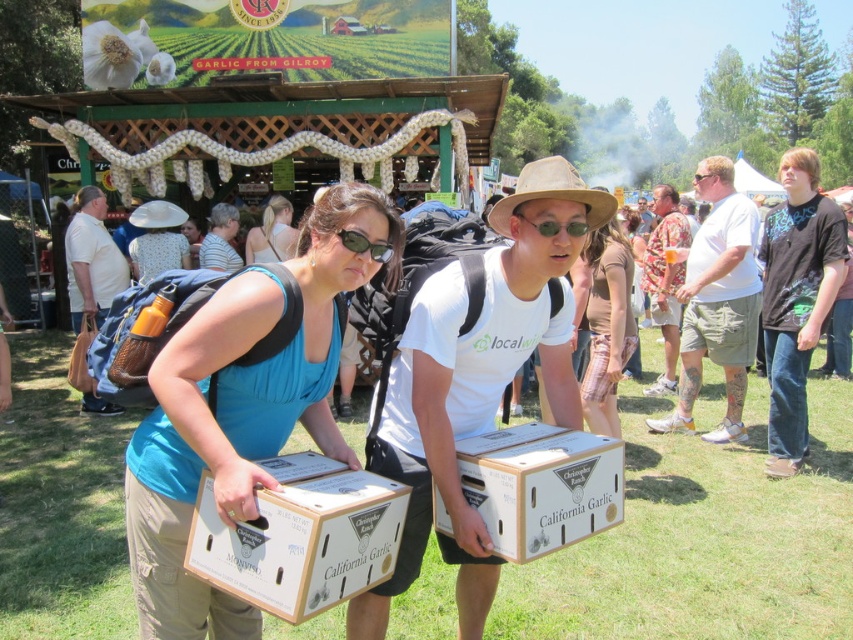
You are a photographer standing at the edge of the festival area. You want to take a photo of the wooden crate at center and the matte blue tank top at center. If your camera has a maximum focus range of 5 meters, will both subjects be in focus?

The wooden crate at center is 5.72 meters from matte blue tank top at center. Since the distance between them exceeds the camera maximum focus range of 5 meters, the camera cannot focus on both subjects simultaneously.

You are a photographer at the event and want to take a photo of the white cardboard box at center without the blue fabric tank top at center blocking it. What should you do?

Move the camera position backward to ensure the blue fabric tank top at center is no longer in front of the white cardboard box at center.